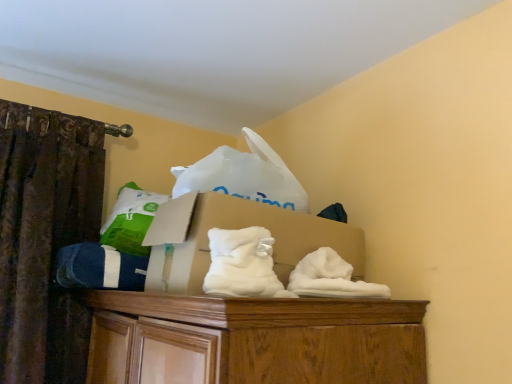
Question: From a real-world perspective, is blue cotton socks at left physically above cardboard box at center?

Choices:
 (A) no
 (B) yes

Answer: (A)

Question: Can you confirm if blue cotton socks at left is smaller than cardboard box at center?

Choices:
 (A) yes
 (B) no

Answer: (A)

Question: Is the position of blue cotton socks at left less distant than that of cardboard box at center?

Choices:
 (A) yes
 (B) no

Answer: (B)

Question: From the image's perspective, is blue cotton socks at left above cardboard box at center?

Choices:
 (A) yes
 (B) no

Answer: (B)

Question: Is blue cotton socks at left behind cardboard box at center?

Choices:
 (A) no
 (B) yes

Answer: (B)

Question: Is blue cotton socks at left located outside cardboard box at center?

Choices:
 (A) yes
 (B) no

Answer: (A)

Question: Considering the relative positions of white fluffy sheet at center and blue cotton socks at left in the image provided, is white fluffy sheet at center to the left of blue cotton socks at left from the viewer's perspective?

Choices:
 (A) yes
 (B) no

Answer: (B)

Question: Is white fluffy sheet at center bigger than blue cotton socks at left?

Choices:
 (A) no
 (B) yes

Answer: (A)

Question: From a real-world perspective, is white fluffy sheet at center positioned over blue cotton socks at left based on gravity?

Choices:
 (A) no
 (B) yes

Answer: (B)

Question: Is white fluffy sheet at center outside blue cotton socks at left?

Choices:
 (A) yes
 (B) no

Answer: (A)

Question: Is blue cotton socks at left completely or partially inside white fluffy sheet at center?

Choices:
 (A) no
 (B) yes

Answer: (A)

Question: From a real-world perspective, is white fluffy sheet at center positioned under blue cotton socks at left based on gravity?

Choices:
 (A) yes
 (B) no

Answer: (B)

Question: Is cardboard box at center smaller than white fluffy sheet at center?

Choices:
 (A) no
 (B) yes

Answer: (A)